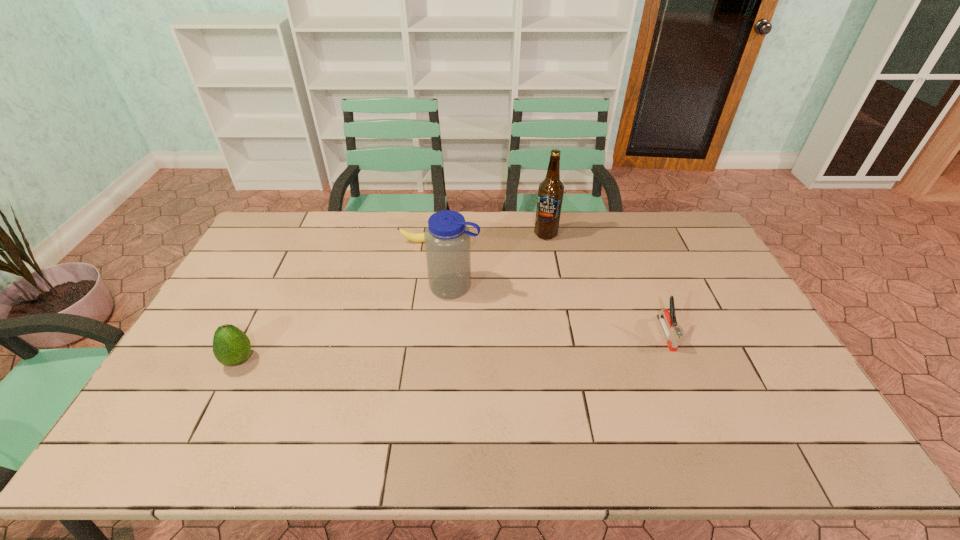
I want to click on banana situated at the far edge, so click(416, 237).

This screenshot has width=960, height=540. What are the coordinates of `beer bottle at the far edge` in the screenshot? It's located at (550, 192).

Where is `object present at the left edge`? object present at the left edge is located at coordinates (231, 346).

Locate an element on the screen. free space at the far edge is located at coordinates (354, 222).

In order to click on vacant region at the near edge of the desktop in this screenshot , I will do `click(308, 399)`.

Find the location of a particular element. vacant space at the left edge of the desktop is located at coordinates point(207,379).

Locate an element on the screen. The height and width of the screenshot is (540, 960). free region at the right edge of the desktop is located at coordinates (772, 367).

This screenshot has width=960, height=540. In the image, there is a desktop. What are the coordinates of `vacant space at the far left corner` in the screenshot? It's located at (276, 226).

In the image, there is a desktop. Where is `free space at the near left corner`? free space at the near left corner is located at coordinates (171, 411).

Find the location of a particular element. free space at the far right corner is located at coordinates (655, 227).